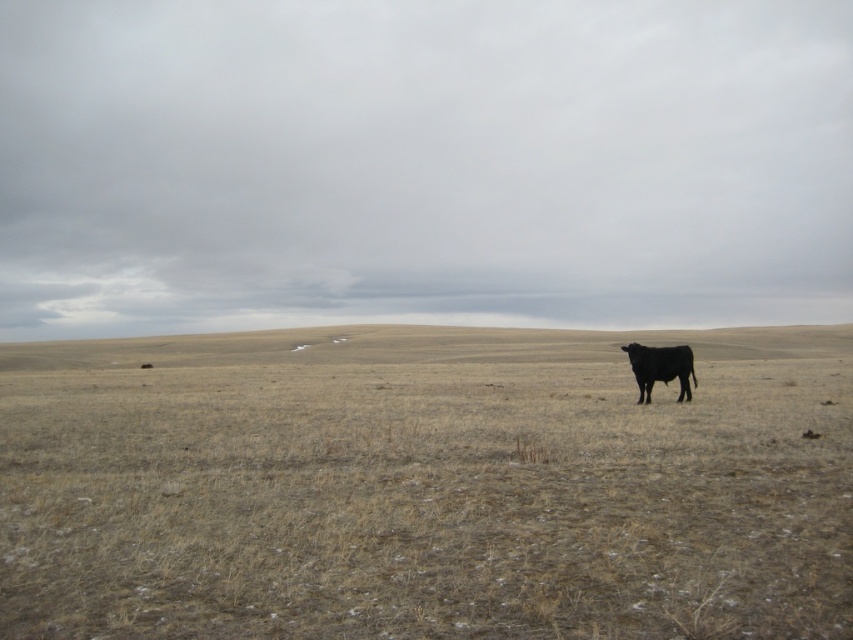
Based on the photo, which is more to the right, brown grassland at center or black smooth bull at right?

brown grassland at center

The image size is (853, 640). I want to click on brown grassland at center, so click(x=425, y=484).

Identify the location of brown grassland at center. This screenshot has height=640, width=853. (425, 484).

I want to click on brown grassland at center, so click(x=425, y=484).